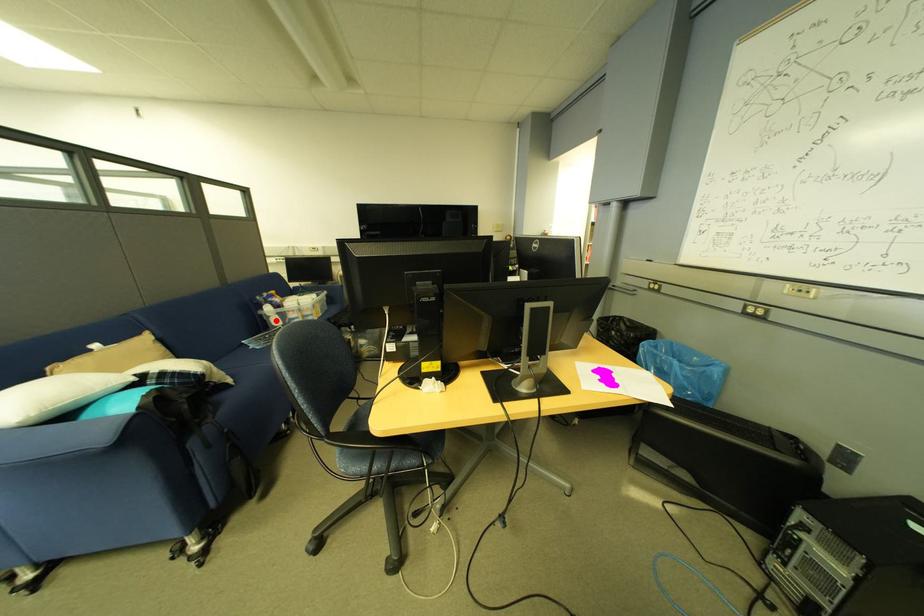
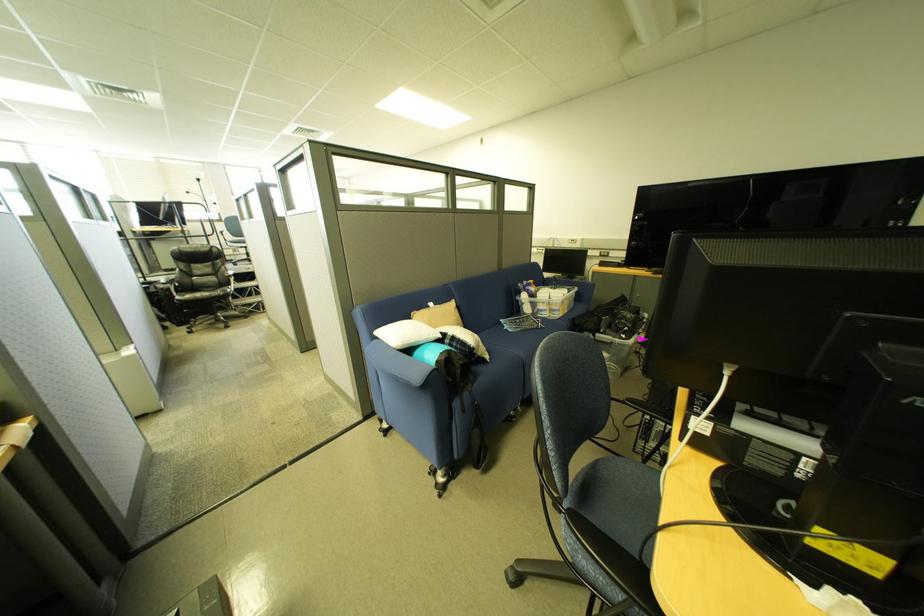
Locate, in the second image, the point that corresponds to the highlighted location in the first image.

(530, 306)